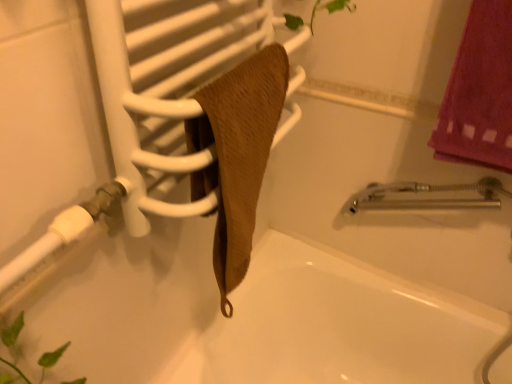
Question: Does white matte shower at lower left have a smaller size compared to white matte bathtub at center?

Choices:
 (A) no
 (B) yes

Answer: (B)

Question: Is white matte shower at lower left wider than white matte bathtub at center?

Choices:
 (A) no
 (B) yes

Answer: (A)

Question: Is white matte shower at lower left at the left side of white matte bathtub at center?

Choices:
 (A) yes
 (B) no

Answer: (A)

Question: Is white matte bathtub at center completely or partially inside white matte shower at lower left?

Choices:
 (A) yes
 (B) no

Answer: (B)

Question: Does white matte shower at lower left have a lesser height compared to white matte bathtub at center?

Choices:
 (A) yes
 (B) no

Answer: (A)

Question: Looking at the image, does brown textured towel at center seem bigger or smaller compared to white matte bathtub at center?

Choices:
 (A) small
 (B) big

Answer: (A)

Question: Considering the positions of brown textured towel at center and white matte bathtub at center in the image, is brown textured towel at center taller or shorter than white matte bathtub at center?

Choices:
 (A) short
 (B) tall

Answer: (A)

Question: From a real-world perspective, is brown textured towel at center physically located above or below white matte bathtub at center?

Choices:
 (A) above
 (B) below

Answer: (A)

Question: Is point click(x=212, y=198) positioned closer to the camera than point click(x=297, y=284)?

Choices:
 (A) closer
 (B) farther

Answer: (A)

Question: Is brown textured towel at center to the left or to the right of white matte shower at lower left in the image?

Choices:
 (A) left
 (B) right

Answer: (B)

Question: From a real-world perspective, is brown textured towel at center physically located above or below white matte shower at lower left?

Choices:
 (A) above
 (B) below

Answer: (A)

Question: From the image's perspective, relative to white matte shower at lower left, is brown textured towel at center above or below?

Choices:
 (A) above
 (B) below

Answer: (A)

Question: Considering their positions, is brown textured towel at center located in front of or behind white matte shower at lower left?

Choices:
 (A) front
 (B) behind

Answer: (A)

Question: Looking at their shapes, would you say brown textured towel at center is wider or thinner than brown textured towel at center?

Choices:
 (A) thin
 (B) wide

Answer: (B)

Question: Is brown textured towel at center bigger or smaller than brown textured towel at center?

Choices:
 (A) big
 (B) small

Answer: (A)